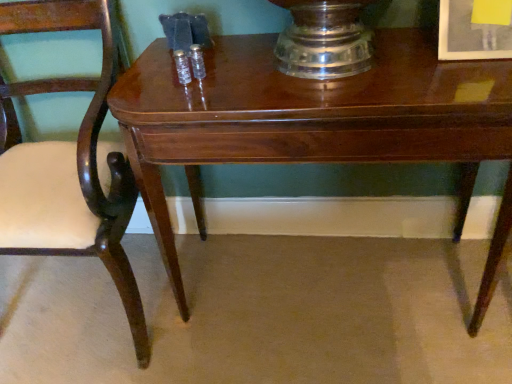
Question: Are mahogany wood chair at left and glossy wood table at center beside each other?

Choices:
 (A) no
 (B) yes

Answer: (A)

Question: From a real-world perspective, is mahogany wood chair at left positioned over glossy wood table at center based on gravity?

Choices:
 (A) yes
 (B) no

Answer: (A)

Question: From the image's perspective, is mahogany wood chair at left beneath glossy wood table at center?

Choices:
 (A) yes
 (B) no

Answer: (B)

Question: Is mahogany wood chair at left shorter than glossy wood table at center?

Choices:
 (A) yes
 (B) no

Answer: (B)

Question: Is mahogany wood chair at left closer to the viewer compared to glossy wood table at center?

Choices:
 (A) yes
 (B) no

Answer: (A)

Question: Choose the correct answer: Is mahogany wood chair at left inside matte white picture frame at upper right or outside it?

Choices:
 (A) inside
 (B) outside

Answer: (B)

Question: Considering the positions of mahogany wood chair at left and matte white picture frame at upper right in the image, is mahogany wood chair at left wider or thinner than matte white picture frame at upper right?

Choices:
 (A) thin
 (B) wide

Answer: (B)

Question: From a real-world perspective, is mahogany wood chair at left above or below matte white picture frame at upper right?

Choices:
 (A) below
 (B) above

Answer: (A)

Question: Looking at the image, does mahogany wood chair at left seem bigger or smaller compared to matte white picture frame at upper right?

Choices:
 (A) small
 (B) big

Answer: (B)

Question: Considering the positions of mahogany wood chair at left and glossy wood table at center in the image, is mahogany wood chair at left taller or shorter than glossy wood table at center?

Choices:
 (A) tall
 (B) short

Answer: (A)

Question: Would you say mahogany wood chair at left is to the left or to the right of glossy wood table at center in the picture?

Choices:
 (A) right
 (B) left

Answer: (B)

Question: In terms of width, does mahogany wood chair at left look wider or thinner when compared to glossy wood table at center?

Choices:
 (A) thin
 (B) wide

Answer: (B)

Question: From a real-world perspective, is mahogany wood chair at left above or below glossy wood table at center?

Choices:
 (A) above
 (B) below

Answer: (A)

Question: Is glossy wood table at center spatially inside matte white picture frame at upper right, or outside of it?

Choices:
 (A) outside
 (B) inside

Answer: (A)

Question: Is glossy wood table at center bigger or smaller than matte white picture frame at upper right?

Choices:
 (A) small
 (B) big

Answer: (B)